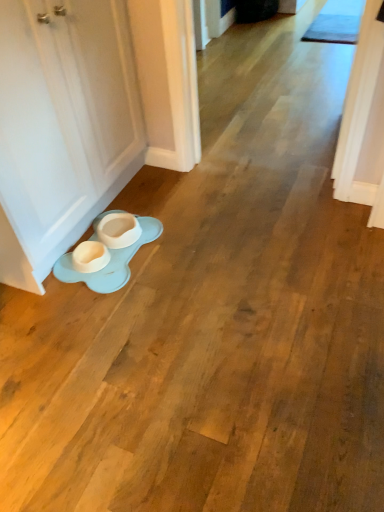
The width and height of the screenshot is (384, 512). What are the coordinates of `free location to the right of white matte door at lower left` in the screenshot? It's located at coord(221,226).